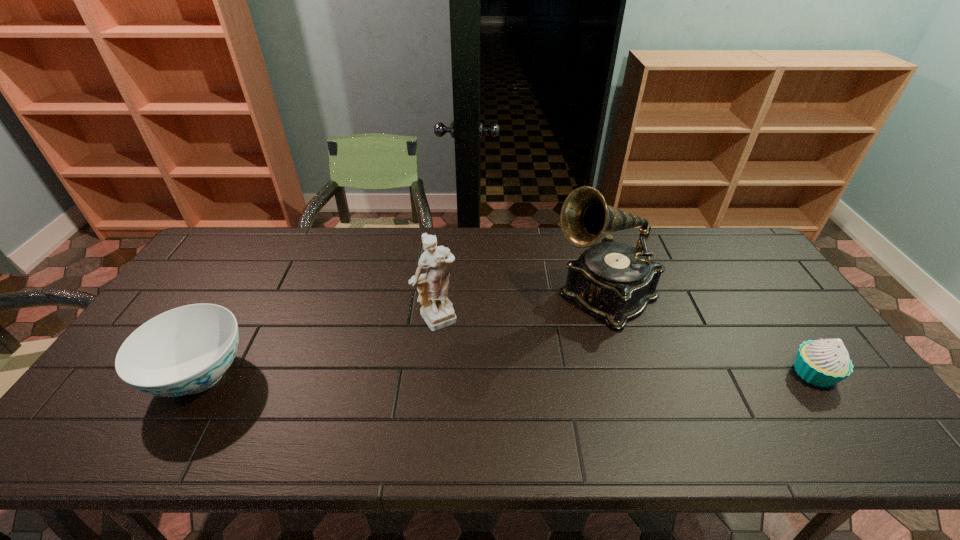
You are a GUI agent. You are given a task and a screenshot of the screen. Output one action in this format:
    pyautogui.click(x=<x>, y=<y>)
    Task: Click on the object at the near right corner
    Image resolution: width=960 pixels, height=540 pixels.
    Given the screenshot: What is the action you would take?
    pyautogui.click(x=823, y=363)

Where is `vacant space at the far edge`? This screenshot has height=540, width=960. vacant space at the far edge is located at coordinates (674, 267).

You are a GUI agent. You are given a task and a screenshot of the screen. Output one action in this format:
    pyautogui.click(x=<x>, y=<y>)
    Task: Click on the free region at the near edge of the desktop
    The height and width of the screenshot is (540, 960).
    Given the screenshot: What is the action you would take?
    pyautogui.click(x=736, y=401)

At what (x,y) coordinates should I click in order to perform the action: click on vacant space at the left edge of the desktop. Please return your answer as a coordinate pair (x, y). Looking at the image, I should click on [x=212, y=291].

What are the coordinates of `free space at the right edge of the desktop` in the screenshot? It's located at (794, 376).

This screenshot has height=540, width=960. In order to click on vacant space at the far left corner of the desktop in this screenshot , I will do `click(252, 240)`.

This screenshot has height=540, width=960. What are the coordinates of `empty space between the third shortest object and the leftmost object` in the screenshot? It's located at (320, 347).

Where is `vacant area between the second object from right to left and the second tallest object`? The image size is (960, 540). vacant area between the second object from right to left and the second tallest object is located at coordinates (521, 307).

Find the location of a particular element. free spot between the phonograph record and the rightmost object is located at coordinates (708, 334).

Where is `free space between the rightmost object and the phonograph record`? The width and height of the screenshot is (960, 540). free space between the rightmost object and the phonograph record is located at coordinates (708, 334).